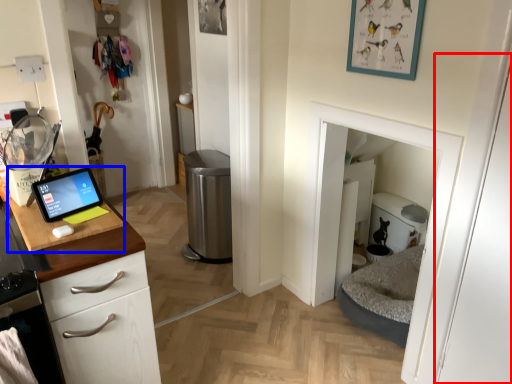
Question: Which object appears farthest to the camera in this image, door (highlighted by a red box) or sink (highlighted by a blue box)?

Choices:
 (A) door
 (B) sink

Answer: (B)